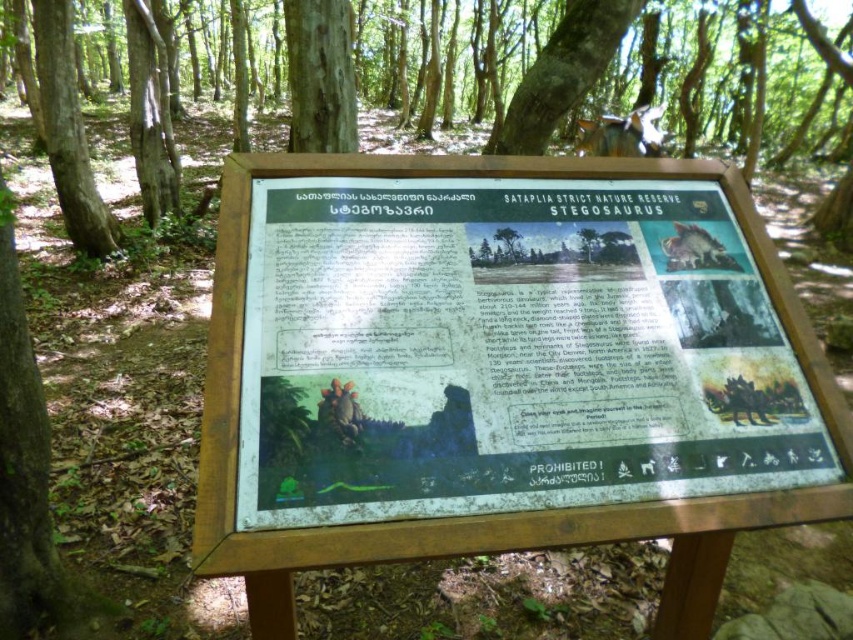
Does white wood sign at center have a larger size compared to smooth bark tree at upper center?

Actually, white wood sign at center might be smaller than smooth bark tree at upper center.

Is point (601, 314) positioned behind point (581, 12)?

That is False.

The height and width of the screenshot is (640, 853). I want to click on white wood sign at center, so click(505, 353).

Does brown wood sign at center have a greater width compared to smooth brown bark at upper center?

Indeed, brown wood sign at center has a greater width compared to smooth brown bark at upper center.

Does brown wood sign at center appear over smooth brown bark at upper center?

Indeed, brown wood sign at center is positioned over smooth brown bark at upper center.

Locate an element on the screen. brown wood sign at center is located at coordinates (756, 93).

You are a GUI agent. You are given a task and a screenshot of the screen. Output one action in this format:
    pyautogui.click(x=<x>, y=<y>)
    Task: Click on the brown wood sign at center
    Image resolution: width=853 pixels, height=640 pixels.
    Given the screenshot: What is the action you would take?
    pyautogui.click(x=756, y=93)

Is point (578, 99) closer to viewer compared to point (312, 20)?

No, it is not.

Who is more distant from viewer, [585,51] or [329,60]?

Point [585,51]

Where is `smooth bark tree at upper center`? smooth bark tree at upper center is located at coordinates (561, 74).